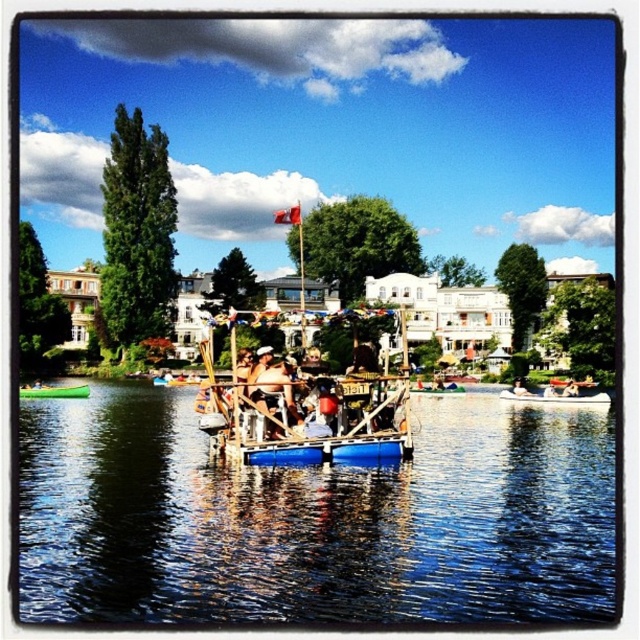
Question: Which point is closer to the camera taking this photo?

Choices:
 (A) (552, 444)
 (B) (541, 394)
 (C) (275, 372)
 (D) (76, 397)

Answer: (C)

Question: Does blue wooden raft at center have a lesser width compared to wooden raft at center?

Choices:
 (A) no
 (B) yes

Answer: (A)

Question: Is white plastic boat at center positioned before green plastic canoe at lower left?

Choices:
 (A) no
 (B) yes

Answer: (B)

Question: Estimate the real-world distances between objects in this image. Which object is closer to the green plastic canoe at lower left?

Choices:
 (A) blue wooden raft at center
 (B) wooden raft at center
 (C) white plastic boat at center

Answer: (A)

Question: Among these points, which one is nearest to the camera?

Choices:
 (A) (52, 385)
 (B) (406, 433)
 (C) (413, 493)

Answer: (C)

Question: Is wooden raft at center above green plastic canoe at lower left?

Choices:
 (A) yes
 (B) no

Answer: (A)